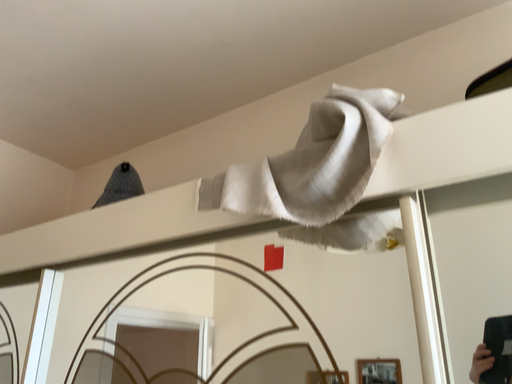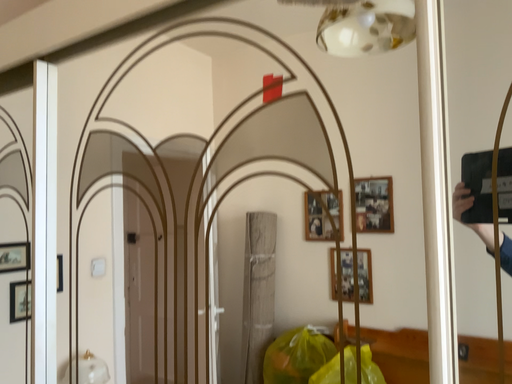
Question: Which way did the camera rotate in the video?

Choices:
 (A) rotated downward
 (B) rotated upward

Answer: (A)